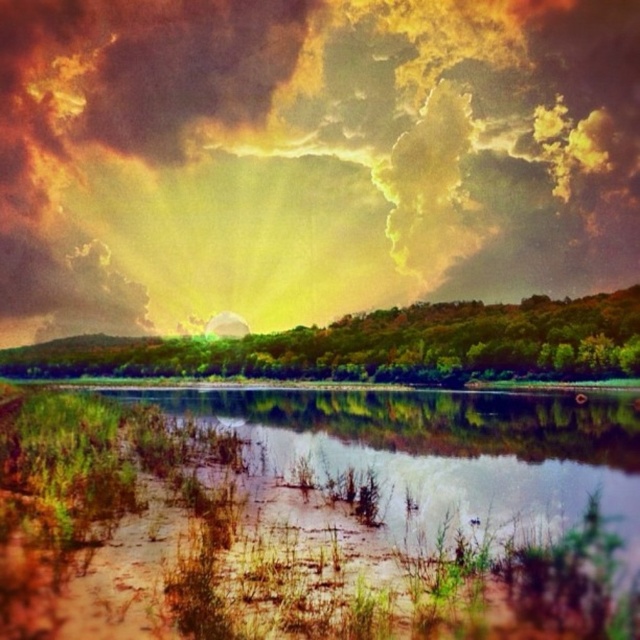
You are standing at the camera position observing the serene landscape. There is a point marked at coordinates point [394,291]. Can you determine if this point is within a safe distance for a drone to land?

The point [394,291] is 237.40 meters away from the camera. Since drones typically have a maximum operational distance of around 500 meters, this point is within a safe distance for a drone to land.